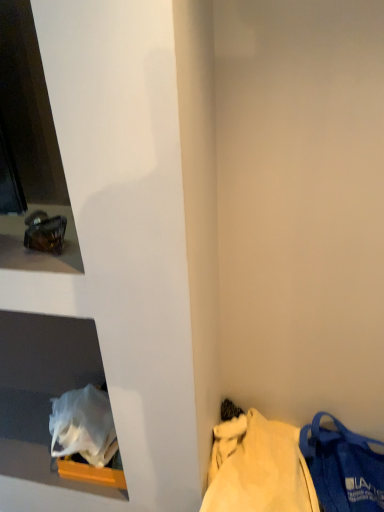
Question: Is matte blue fabric bag at lower right facing towards matte glass ashtray at upper left?

Choices:
 (A) no
 (B) yes

Answer: (A)

Question: From a real-world perspective, is matte blue fabric bag at lower right on matte glass ashtray at upper left?

Choices:
 (A) yes
 (B) no

Answer: (B)

Question: From the image's perspective, is matte blue fabric bag at lower right located beneath matte glass ashtray at upper left?

Choices:
 (A) yes
 (B) no

Answer: (A)

Question: Considering the relative sizes of matte blue fabric bag at lower right and matte glass ashtray at upper left in the image provided, is matte blue fabric bag at lower right thinner than matte glass ashtray at upper left?

Choices:
 (A) no
 (B) yes

Answer: (A)

Question: Would you say matte glass ashtray at upper left is part of matte blue fabric bag at lower right's contents?

Choices:
 (A) yes
 (B) no

Answer: (B)

Question: Considering their positions, is matte blue fabric bag at lower right located in front of or behind blue fabric tote bag at lower right?

Choices:
 (A) front
 (B) behind

Answer: (B)

Question: From the image's perspective, is matte blue fabric bag at lower right above or below blue fabric tote bag at lower right?

Choices:
 (A) below
 (B) above

Answer: (A)

Question: Is matte blue fabric bag at lower right taller or shorter than blue fabric tote bag at lower right?

Choices:
 (A) tall
 (B) short

Answer: (A)

Question: Visually, is matte blue fabric bag at lower right positioned to the left or to the right of blue fabric tote bag at lower right?

Choices:
 (A) left
 (B) right

Answer: (B)

Question: From a real-world perspective, is white plastic bag at lower left physically located above or below matte blue fabric bag at lower right?

Choices:
 (A) above
 (B) below

Answer: (A)

Question: Which is correct: white plastic bag at lower left is inside matte blue fabric bag at lower right, or outside of it?

Choices:
 (A) outside
 (B) inside

Answer: (A)

Question: Is white plastic bag at lower left taller or shorter than matte blue fabric bag at lower right?

Choices:
 (A) short
 (B) tall

Answer: (A)

Question: From the image's perspective, is white plastic bag at lower left above or below matte blue fabric bag at lower right?

Choices:
 (A) above
 (B) below

Answer: (A)

Question: From a real-world perspective, is white plastic bag at lower left positioned above or below matte glass ashtray at upper left?

Choices:
 (A) below
 (B) above

Answer: (A)

Question: From the image's perspective, is white plastic bag at lower left located above or below matte glass ashtray at upper left?

Choices:
 (A) below
 (B) above

Answer: (A)